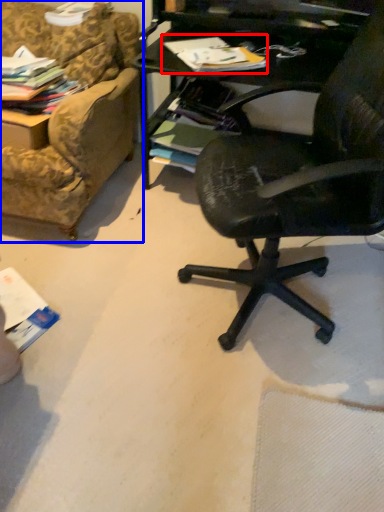
Question: Which object appears closest to the camera in this image, magazine (highlighted by a red box) or studio couch (highlighted by a blue box)?

Choices:
 (A) magazine
 (B) studio couch

Answer: (A)